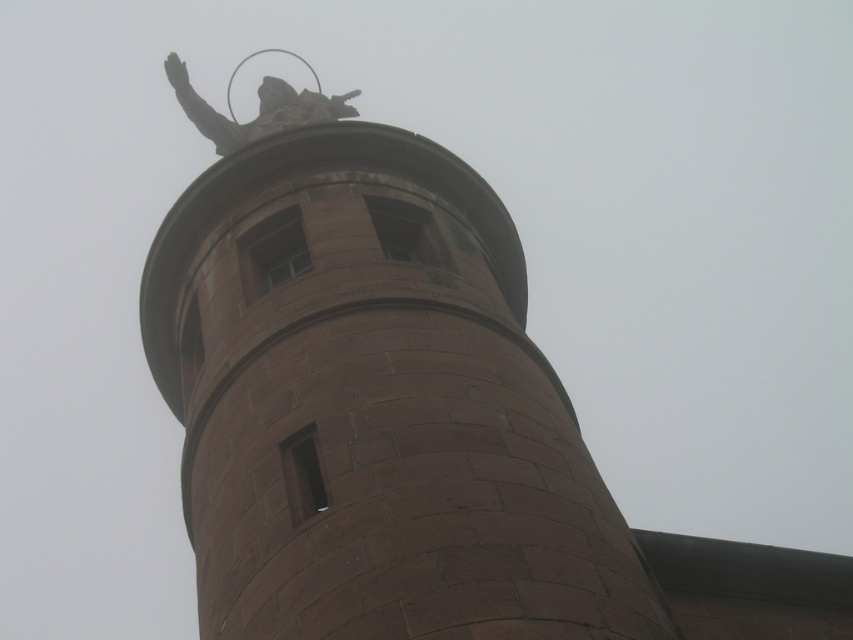
You are an architect examining the brown stone spire at upper center and the polished bronze statue at upper center. Which object takes up more area in the image?

The polished bronze statue at upper center takes up more area in the image than the brown stone spire at upper center because the brown stone spire occupies less space than the polished bronze statue at upper center.

You are an architect examining the brown stone spire at upper center and the polished bronze statue at upper center. Which object is taller?

The polished bronze statue at upper center is taller than the brown stone spire at upper center.

You are standing at the base of the cylindrical structure and want to place a small weather vane at the point marked by coordinates point (x=370, y=397). Based on the scene description, can you confirm whether this point is located on the brown stone spire at upper center?

Yes, the point (x=370, y=397) is on the brown stone spire at upper center, so placing the weather vane there is feasible.